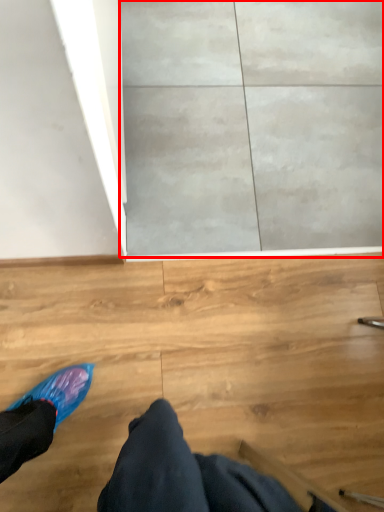
Question: From the image, what is the correct spatial relationship of concrete (annotated by the red box) in relation to person?

Choices:
 (A) right
 (B) left

Answer: (A)